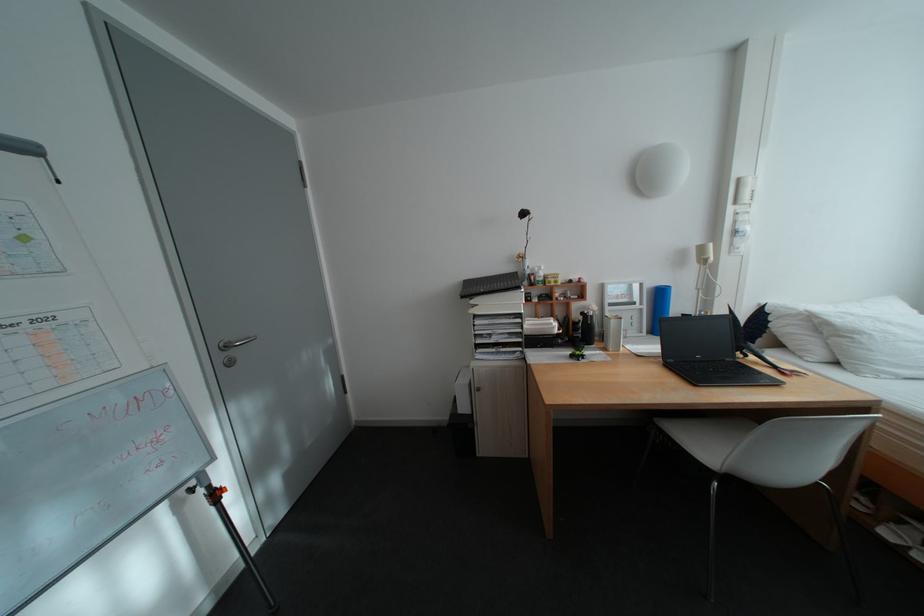
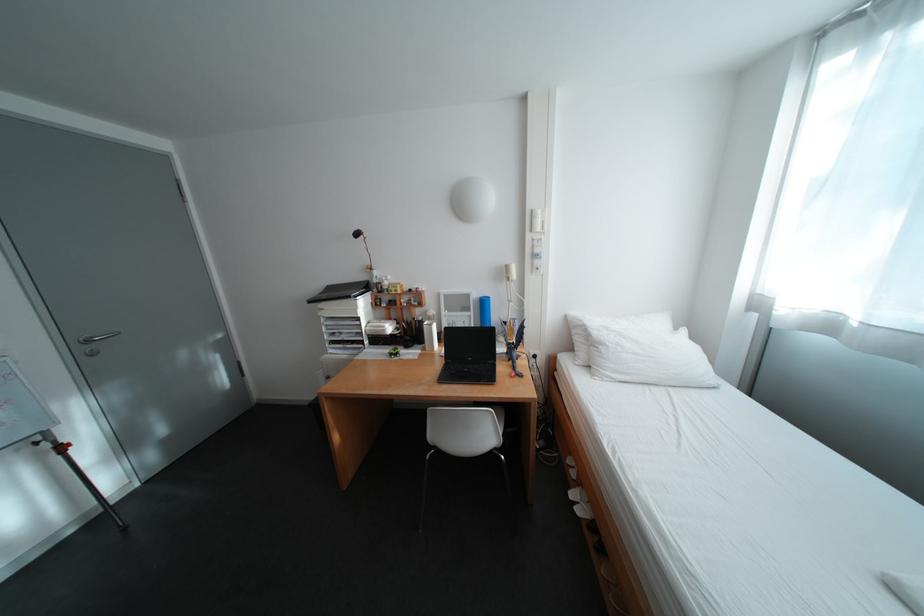
Where in the second image is the point corresponding to the point at 657,307 from the first image?

(484, 314)